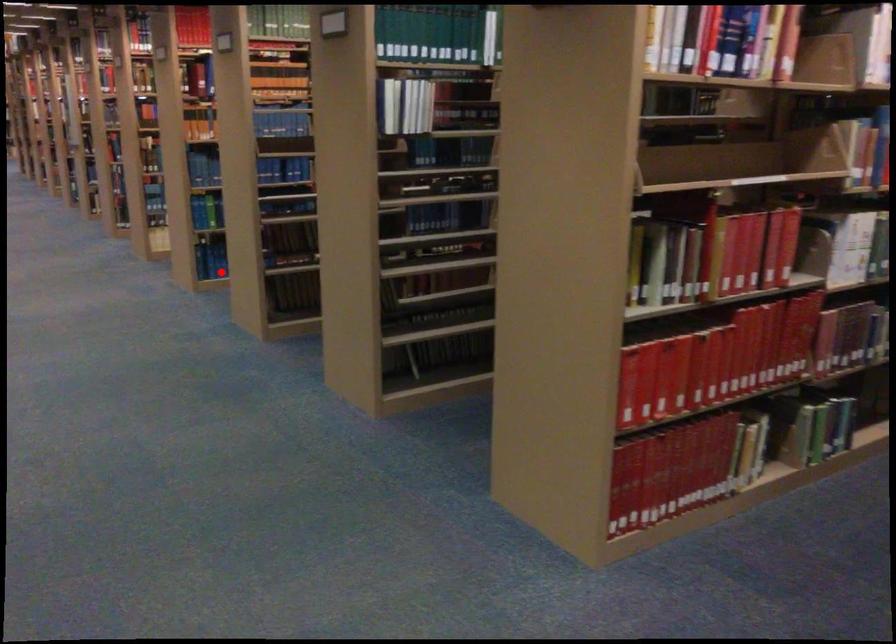
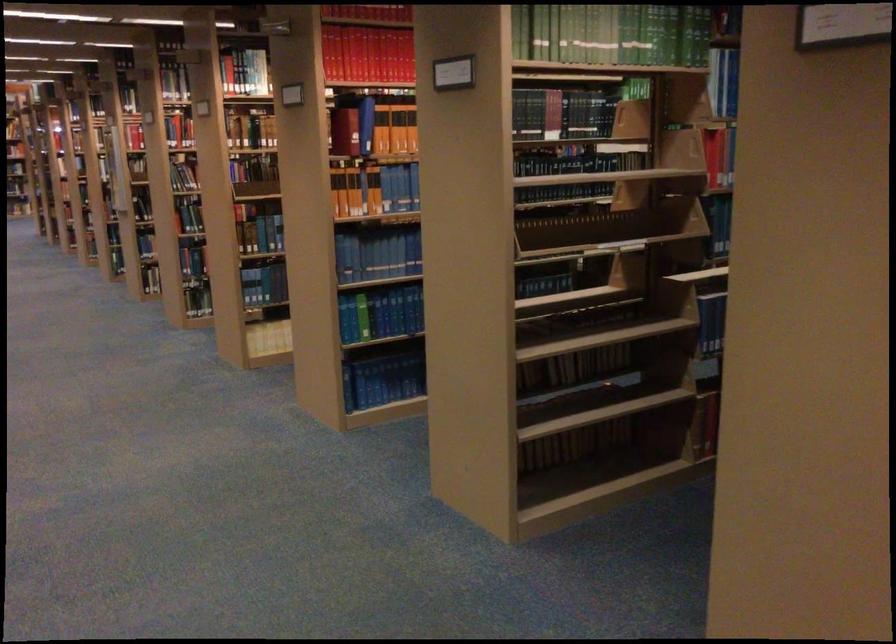
Question: I am providing you with two images of the same scene from different viewpoints. Given a red point in image1, look at the same physical point in image2. Is it:

Choices:
 (A) Closer to the viewpoint
 (B) Farther from the viewpoint

Answer: (A)